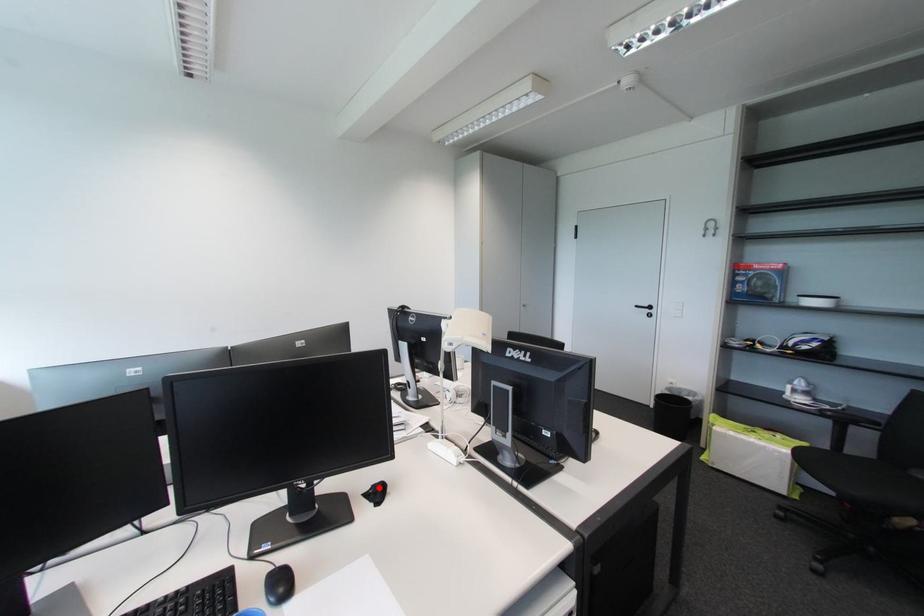
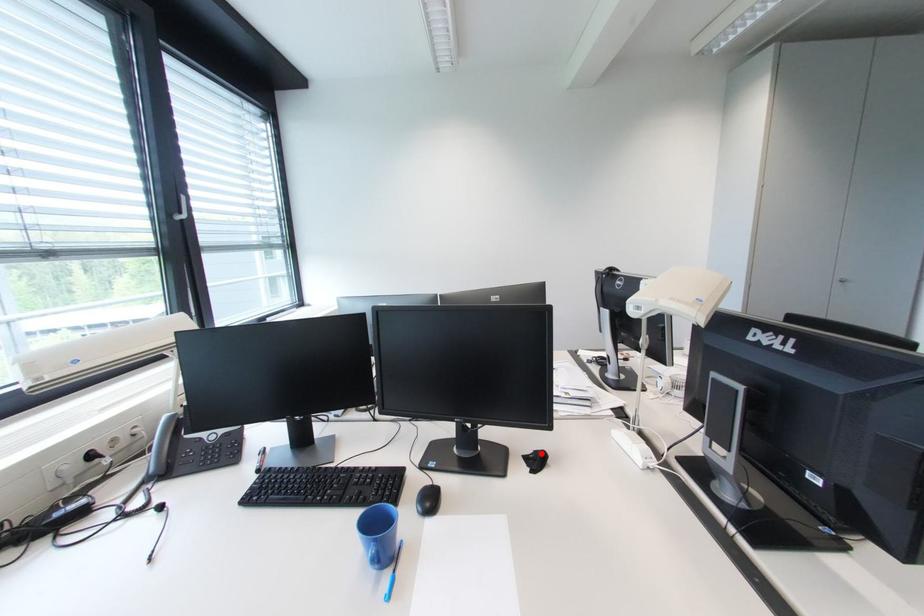
I am providing you with two images of the same scene from different viewpoints. A red point is marked on the first image and another point is marked on the second image. Does the point marked in image1 correspond to the same location as the one in image2?

Yes